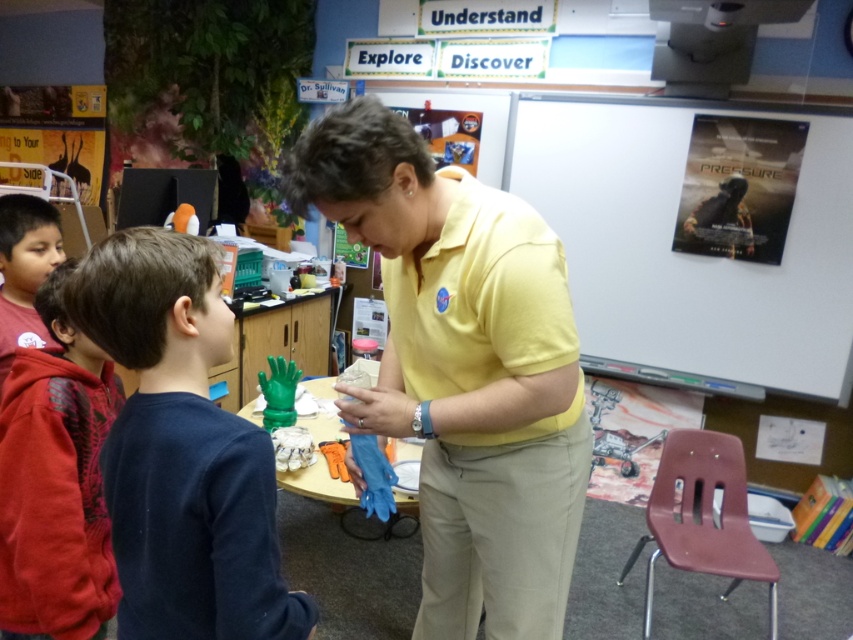
Is yellow smooth shirt at center bigger than matte red hoodie at left?

Yes, yellow smooth shirt at center is bigger than matte red hoodie at left.

Which is behind, point (498, 611) or point (3, 317)?

The point (3, 317) is more distant.

Identify the location of yellow smooth shirt at center. The height and width of the screenshot is (640, 853). (463, 369).

Based on the photo, which is below, red fleece hoodie at left or matte red hoodie at left?

red fleece hoodie at left

This screenshot has height=640, width=853. Describe the element at coordinates (56, 483) in the screenshot. I see `red fleece hoodie at left` at that location.

Identify the location of red fleece hoodie at left. The height and width of the screenshot is (640, 853). (56, 483).

Can you confirm if yellow smooth shirt at center is smaller than white matte poster at upper right?

Correct, yellow smooth shirt at center occupies less space than white matte poster at upper right.

Does yellow smooth shirt at center appear on the left side of white matte poster at upper right?

Correct, you'll find yellow smooth shirt at center to the left of white matte poster at upper right.

Is point (366, 204) positioned before point (845, 244)?

Yes, it is.

This screenshot has height=640, width=853. I want to click on yellow smooth shirt at center, so click(463, 369).